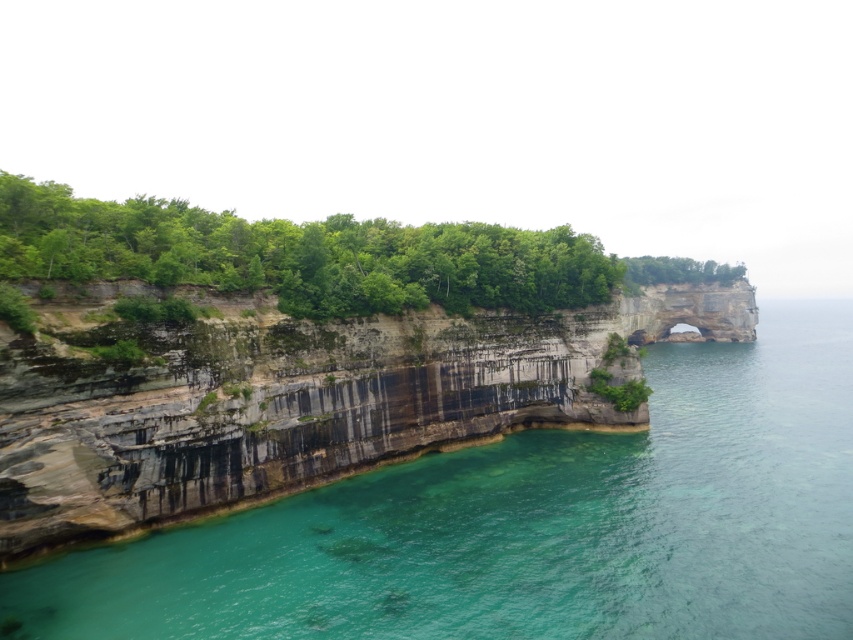
You are standing on the cliff edge and want to observe the clear water at lower left and the green leafy trees at upper center. Which of these two is positioned to the right side from your viewpoint?

The clear water at lower left is positioned to the right of the green leafy trees at upper center, so the clear water at lower left is more to the right side from your viewpoint.

You are a hiker standing at the top of the cliffs looking down. You notice the clear water at lower left and the green leafy trees at upper center. Which object is closer to your current position?

The green leafy trees at upper center are closer to your current position because they are located above the clear water at lower left, which is further down the cliff.

You are a hiker standing at the base of the cliffs and want to reach the green leafy tree at upper center. There is a narrow path between the clear water at lower left and the cliff edge. Can you safely walk along this path if the path is only 1 meter wide?

The clear water at lower left is 73.57 meters away from the green leafy tree at upper center. Since the path between them is only 1 meter wide, it is too narrow for safe passage. You should find a wider path or alternative route to reach the tree safely.